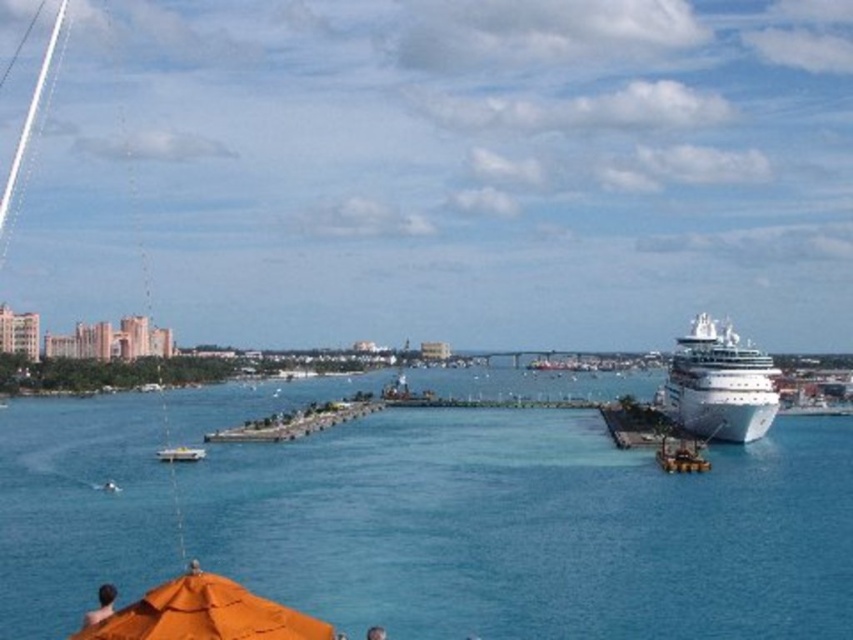
You are a photographer setting up equipment on the white concrete dock at right. You want to place a large tripod between the orange fabric umbrella at lower left and the dock. Is there enough space considering their sizes?

The orange fabric umbrella at lower left is smaller than the white concrete dock at right, so there should be sufficient space to place the tripod between them.

You are a photographer standing at the edge of the jetty. You want to take a photo that includes both the light brown skin at lower left and the white plastic boat at lower left. Which object should be positioned lower in the frame to ensure both are visible?

The light brown skin at lower left is taller than the white plastic boat at lower left, so to ensure both are visible in the photo, the white plastic boat at lower left should be positioned lower in the frame.

You are standing at the position of the camera observing the coastal scene. There are two points marked in the image, one at coordinates point (x=213, y=600) and the other at point (x=619, y=438). Which point is nearer to you?

Point (x=213, y=600) is closer to the camera than point (x=619, y=438), so the first point is nearer to you.